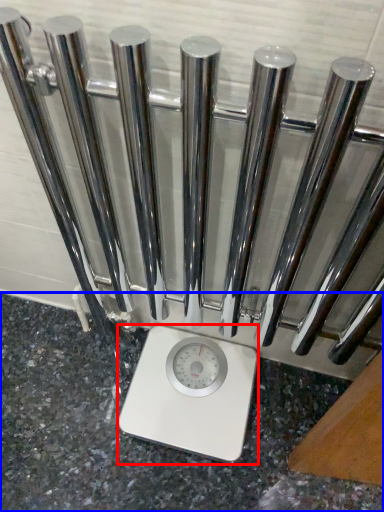
Question: Which of the following is the closest to the observer, scale (highlighted by a red box) or granite (highlighted by a blue box)?

Choices:
 (A) scale
 (B) granite

Answer: (B)